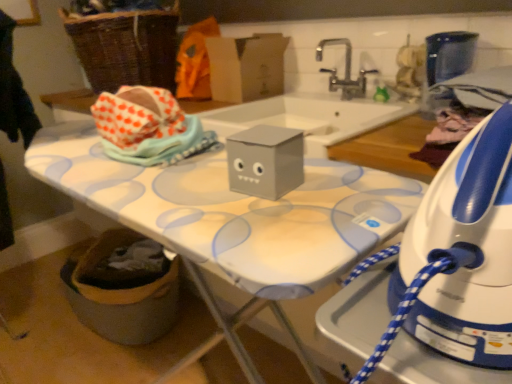
This screenshot has width=512, height=384. Describe the element at coordinates (126, 47) in the screenshot. I see `woven brown basket at upper left` at that location.

Measure the distance between point (x=245, y=150) and camera.

29.45 inches.

Measure the distance between cardboard box at upper center and camera.

5.77 feet.

You are a GUI agent. You are given a task and a screenshot of the screen. Output one action in this format:
    pyautogui.click(x=<x>, y=<y>)
    Task: Click on the orange fabric at upper center
    The width and height of the screenshot is (512, 384).
    Given the screenshot: What is the action you would take?
    pyautogui.click(x=195, y=61)

You are a GUI agent. You are given a task and a screenshot of the screen. Output one action in this format:
    pyautogui.click(x=<x>, y=<y>)
    Task: Click on the woven brown basket at upper left
    The image size is (512, 384).
    Given the screenshot: What is the action you would take?
    pyautogui.click(x=126, y=47)

Image resolution: width=512 pixels, height=384 pixels. Find the location of `fabric behind the woven brown basket at upper left`. fabric behind the woven brown basket at upper left is located at coordinates (195, 61).

Is point (170, 58) behind point (197, 89)?

Yes.

From a real-world perspective, is woven brown basket at upper left over orange fabric at upper center?

Yes, from a real-world perspective, woven brown basket at upper left is over orange fabric at upper center

Considering the sizes of woven brown basket at upper left and orange fabric at upper center in the image, is woven brown basket at upper left bigger or smaller than orange fabric at upper center?

woven brown basket at upper left is bigger than orange fabric at upper center.

Which is more to the left, gray matte box at center or cardboard box at upper center?

From the viewer's perspective, cardboard box at upper center appears more on the left side.

Who is smaller, gray matte box at center or cardboard box at upper center?

With smaller size is gray matte box at center.

The width and height of the screenshot is (512, 384). In the image, there is a cardboard box at upper center. Identify the location of box below it (from a real-world perspective). (265, 161).

How far apart are gray matte box at center and cardboard box at upper center?

A distance of 3.71 feet exists between gray matte box at center and cardboard box at upper center.

Is cardboard box at upper center a part of orange fabric at upper center?

Actually, cardboard box at upper center is outside orange fabric at upper center.

Considering the relative sizes of orange fabric at upper center and cardboard box at upper center in the image provided, is orange fabric at upper center wider than cardboard box at upper center?

No, orange fabric at upper center is not wider than cardboard box at upper center.

Is orange fabric at upper center directly adjacent to cardboard box at upper center?

orange fabric at upper center and cardboard box at upper center are not in contact.

Considering the positions of points (185, 44) and (212, 53), is point (185, 44) closer to camera compared to point (212, 53)?

No, (185, 44) is further to viewer.

Which point is more distant from viewer, (292, 142) or (389, 294)?

The point (292, 142) is farther.

Is gray matte box at center shorter than white plastic iron at right?

Yes, gray matte box at center is shorter than white plastic iron at right.

Considering the relative positions of gray matte box at center and white plastic iron at right in the image provided, is gray matte box at center to the left of white plastic iron at right from the viewer's perspective?

Correct, you'll find gray matte box at center to the left of white plastic iron at right.

Is gray matte box at center beside white plastic iron at right?

gray matte box at center is not next to white plastic iron at right, and they're not touching.

Between orange fabric at upper center and silver metallic faucet at upper center, which one is positioned in front?

Answer: Positioned in front is silver metallic faucet at upper center.

Based on the photo, is orange fabric at upper center located outside silver metallic faucet at upper center?

Yes.

Is orange fabric at upper center wider or thinner than silver metallic faucet at upper center?

In the image, orange fabric at upper center appears to be more narrow than silver metallic faucet at upper center.

How much distance is there between orange fabric at upper center and silver metallic faucet at upper center?

A distance of 21.58 inches exists between orange fabric at upper center and silver metallic faucet at upper center.

Is gray matte box at center in front of silver metallic faucet at upper center?

Yes, the depth of gray matte box at center is less than that of silver metallic faucet at upper center.

Based on the photo, is gray matte box at center placed right next to silver metallic faucet at upper center?

No.

From a real-world perspective, which is physically above, gray matte box at center or silver metallic faucet at upper center?

In real-world perspective, silver metallic faucet at upper center is above.

Is there a large distance between white plastic iron at right and silver metallic faucet at upper center?

That's right, there is a large distance between white plastic iron at right and silver metallic faucet at upper center.

Is point (332, 312) positioned behind point (348, 43)?

No.

From the image's perspective, between white plastic iron at right and silver metallic faucet at upper center, who is located below?

white plastic iron at right is shown below in the image.

From a real-world perspective, is white plastic iron at right positioned over silver metallic faucet at upper center based on gravity?

No, from a real-world perspective, white plastic iron at right is not over silver metallic faucet at upper center

Identify the location of basket above the orange fabric at upper center (from a real-world perspective). This screenshot has width=512, height=384. (126, 47).

In the image, there is a cardboard box at upper center. Identify the location of box below it (from the image's perspective). (265, 161).

When comparing their distances from silver metallic faucet at upper center, does woven brown basket at upper left or white plastic iron at right seem further?

white plastic iron at right is further to silver metallic faucet at upper center.

Considering their positions, is white plastic iron at right positioned further to cardboard box at upper center than orange fabric at upper center?

The object further to cardboard box at upper center is white plastic iron at right.

Which object lies further to the anchor point woven brown basket at upper left, cardboard box at upper center or orange fabric at upper center?

The object further to woven brown basket at upper left is cardboard box at upper center.

Based on their spatial positions, is cardboard box at upper center or orange fabric at upper center further from white plastic iron at right?

orange fabric at upper center is further to white plastic iron at right.

From the image, which object appears to be nearer to orange fabric at upper center, white plastic iron at right or woven brown basket at upper left?

woven brown basket at upper left.

Estimate the real-world distances between objects in this image. Which object is further from gray matte box at center, cardboard box at upper center or orange fabric at upper center?

Among the two, orange fabric at upper center is located further to gray matte box at center.

Considering their positions, is orange fabric at upper center positioned further to gray matte box at center than silver metallic faucet at upper center?

orange fabric at upper center is further to gray matte box at center.

From the image, which object appears to be farther from silver metallic faucet at upper center, white plastic iron at right or orange fabric at upper center?

Based on the image, white plastic iron at right appears to be further to silver metallic faucet at upper center.

Identify the location of tap between white plastic iron at right and orange fabric at upper center in the front-back direction. This screenshot has width=512, height=384. (345, 71).

At what (x,y) coordinates should I click in order to perform the action: click on tap between white plastic iron at right and cardboard box at upper center in the front-back direction. Please return your answer as a coordinate pair (x, y). Looking at the image, I should click on (345, 71).

Identify the location of box located between white plastic iron at right and silver metallic faucet at upper center in the depth direction. (265, 161).

This screenshot has height=384, width=512. I want to click on tap between gray matte box at center and woven brown basket at upper left along the z-axis, so [345, 71].